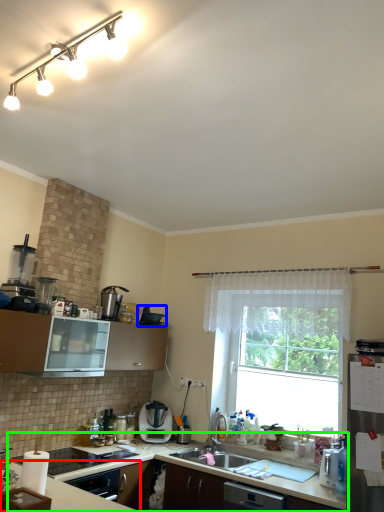
Question: Estimate the real-world distances between objects in this image. Which object is closer to countertop (highlighted by a red box), appliance (highlighted by a blue box) or countertop (highlighted by a green box)?

Choices:
 (A) appliance
 (B) countertop

Answer: (B)